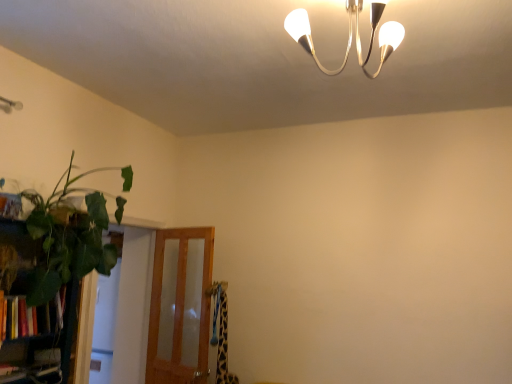
The height and width of the screenshot is (384, 512). In order to click on hardcover books at left in this screenshot , I will do `click(31, 317)`.

Where is `translucent wood screen door at lower left`? This screenshot has width=512, height=384. translucent wood screen door at lower left is located at coordinates (178, 303).

Describe the element at coordinates (48, 337) in the screenshot. I see `green leafy plant at left` at that location.

Where is `hardcover books at left`? hardcover books at left is located at coordinates (31, 317).

How different are the orientations of green leafy plant at left and hardcover books at left in degrees?

2.99 degrees separate the facing orientations of green leafy plant at left and hardcover books at left.

Does point (65, 367) come in front of point (0, 307)?

That is False.

Where is `book positioned vertically above the green leafy plant at left (from a real-world perspective)`? This screenshot has width=512, height=384. book positioned vertically above the green leafy plant at left (from a real-world perspective) is located at coordinates (31, 317).

Which of these two, green leafy plant at left or hardcover books at left, is thinner?

Thinner between the two is hardcover books at left.

Considering their positions, is hardcover books at left located in front of or behind translucent wood screen door at lower left?

Clearly, hardcover books at left is in front of translucent wood screen door at lower left.

Does hardcover books at left turn towards translucent wood screen door at lower left?

No, hardcover books at left is not facing towards translucent wood screen door at lower left.

From a real-world perspective, which is physically below, hardcover books at left or translucent wood screen door at lower left?

In real-world perspective, translucent wood screen door at lower left is lower.

Is hardcover books at left next to translucent wood screen door at lower left?

No, hardcover books at left is not making contact with translucent wood screen door at lower left.

From a real-world perspective, between green leafy plant at left and green leafy plant at left, who is vertically lower?

In real-world perspective, green leafy plant at left is lower.

Is green leafy plant at left located outside green leafy plant at left?

Yes, green leafy plant at left is located beyond the bounds of green leafy plant at left.

Is green leafy plant at left at the back of green leafy plant at left?

Yes.

Does translucent wood screen door at lower left have a lesser height compared to green leafy plant at left?

Incorrect, the height of translucent wood screen door at lower left does not fall short of that of green leafy plant at left.

From a real-world perspective, which is physically below, translucent wood screen door at lower left or green leafy plant at left?

translucent wood screen door at lower left, from a real-world perspective.

Can you confirm if translucent wood screen door at lower left is thinner than green leafy plant at left?

Yes, translucent wood screen door at lower left is thinner than green leafy plant at left.

Measure the distance from translucent wood screen door at lower left to green leafy plant at left.

translucent wood screen door at lower left is 3.87 feet from green leafy plant at left.

Could you tell me if hardcover books at left is turned towards green leafy plant at left?

Yes, hardcover books at left is turned towards green leafy plant at left.

Between hardcover books at left and green leafy plant at left, which one has smaller size?

hardcover books at left.

Who is more distant, hardcover books at left or green leafy plant at left?

Positioned behind is hardcover books at left.

Is hardcover books at left aimed at green leafy plant at left?

Yes.

Can you confirm if hardcover books at left is shorter than green leafy plant at left?

Indeed, hardcover books at left has a lesser height compared to green leafy plant at left.

Is point (60, 325) closer to camera compared to point (44, 201)?

That is True.

Is green leafy plant at left smaller than translucent wood screen door at lower left?

Actually, green leafy plant at left might be larger than translucent wood screen door at lower left.

Looking at their sizes, would you say green leafy plant at left is wider or thinner than translucent wood screen door at lower left?

Clearly, green leafy plant at left has more width compared to translucent wood screen door at lower left.

Consider the image. Who is more distant, green leafy plant at left or translucent wood screen door at lower left?

translucent wood screen door at lower left.

Which is nearer, (32, 338) or (172, 272)?

Point (32, 338) is positioned closer to the camera compared to point (172, 272).

This screenshot has width=512, height=384. I want to click on bookshelf on the left of hardcover books at left, so click(48, 337).

This screenshot has width=512, height=384. In the image, there is a translucent wood screen door at lower left. Find the location of `book above it (from the image's perspective)`. book above it (from the image's perspective) is located at coordinates (31, 317).

Based on their spatial positions, is green leafy plant at left or green leafy plant at left further from translucent wood screen door at lower left?

The object further to translucent wood screen door at lower left is green leafy plant at left.

Considering their positions, is hardcover books at left positioned further to translucent wood screen door at lower left than green leafy plant at left?

hardcover books at left.

Based on their spatial positions, is hardcover books at left or green leafy plant at left closer to green leafy plant at left?

Among the two, hardcover books at left is located nearer to green leafy plant at left.

When comparing their distances from translucent wood screen door at lower left, does hardcover books at left or green leafy plant at left seem closer?

Based on the image, green leafy plant at left appears to be nearer to translucent wood screen door at lower left.

Looking at this image, from the image, which object appears to be nearer to green leafy plant at left, translucent wood screen door at lower left or hardcover books at left?

Based on the image, hardcover books at left appears to be nearer to green leafy plant at left.

Which object lies further to the anchor point green leafy plant at left, translucent wood screen door at lower left or green leafy plant at left?

Based on the image, translucent wood screen door at lower left appears to be further to green leafy plant at left.

Considering their positions, is green leafy plant at left positioned further to translucent wood screen door at lower left than hardcover books at left?

Based on the image, hardcover books at left appears to be further to translucent wood screen door at lower left.

Looking at the image, which one is located further to green leafy plant at left, hardcover books at left or translucent wood screen door at lower left?

translucent wood screen door at lower left lies further to green leafy plant at left than the other object.

What are the coordinates of `bookshelf between green leafy plant at left and translucent wood screen door at lower left along the z-axis` in the screenshot? It's located at (48, 337).

Find the location of a particular element. The image size is (512, 384). book between green leafy plant at left and translucent wood screen door at lower left in the front-back direction is located at coordinates (31, 317).

Locate an element on the screen. The width and height of the screenshot is (512, 384). book between green leafy plant at left and translucent wood screen door at lower left along the z-axis is located at coordinates (31, 317).

Where is `book between green leafy plant at left and green leafy plant at left from top to bottom`? book between green leafy plant at left and green leafy plant at left from top to bottom is located at coordinates (31, 317).